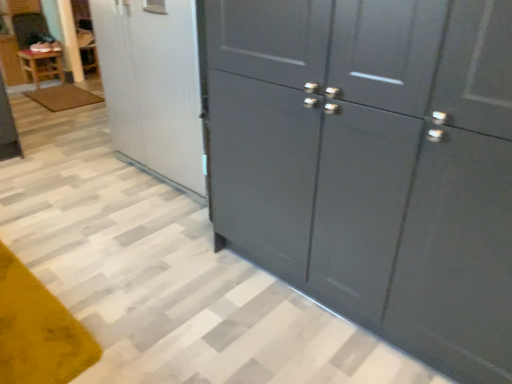
The width and height of the screenshot is (512, 384). Identify the location of blank space above brown textured mat at lower left (from a real-world perspective). (66, 92).